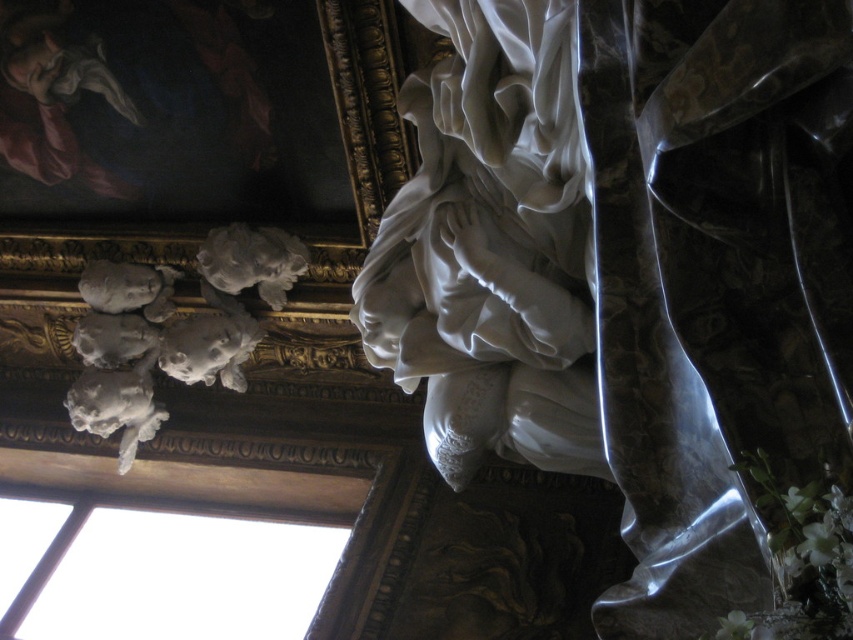
Question: Is white marble statue at center wider than white marble cherubs at upper left?

Choices:
 (A) no
 (B) yes

Answer: (A)

Question: Can you confirm if transparent glass window at upper left is positioned to the left of white marble cherubs at upper left?

Choices:
 (A) yes
 (B) no

Answer: (B)

Question: Estimate the real-world distances between objects in this image. Which object is closer to the white marble statue at center?

Choices:
 (A) white marble cherubs at upper left
 (B) transparent glass window at upper left

Answer: (A)

Question: Based on their relative distances, which object is farther from the white marble statue at center?

Choices:
 (A) transparent glass window at upper left
 (B) white marble cherubs at upper left

Answer: (A)

Question: Which point is farther to the camera?

Choices:
 (A) (117, 524)
 (B) (93, 406)
 (C) (440, 189)

Answer: (A)

Question: Can you confirm if white marble statue at center is positioned to the left of white marble cherubs at upper left?

Choices:
 (A) yes
 (B) no

Answer: (B)